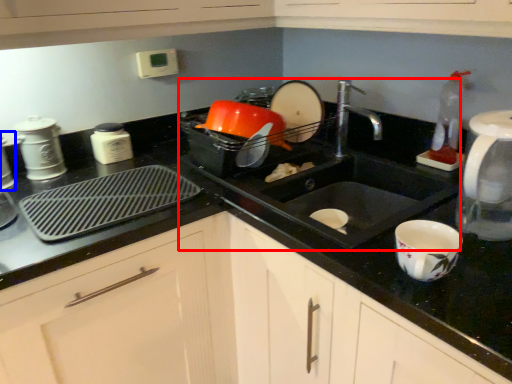
Question: Which point is further to the camera, sink (highlighted by a red box) or appliance (highlighted by a blue box)?

Choices:
 (A) sink
 (B) appliance

Answer: (B)